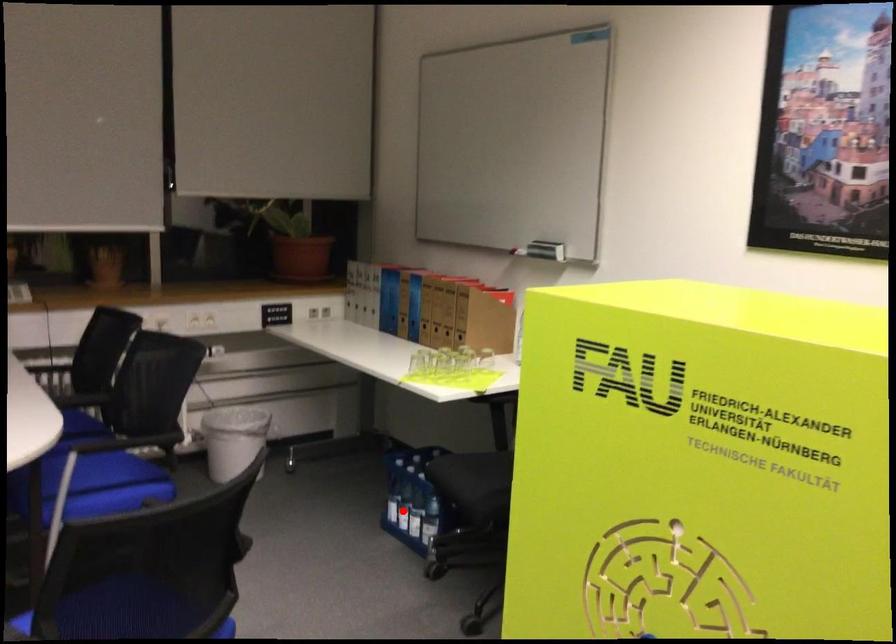
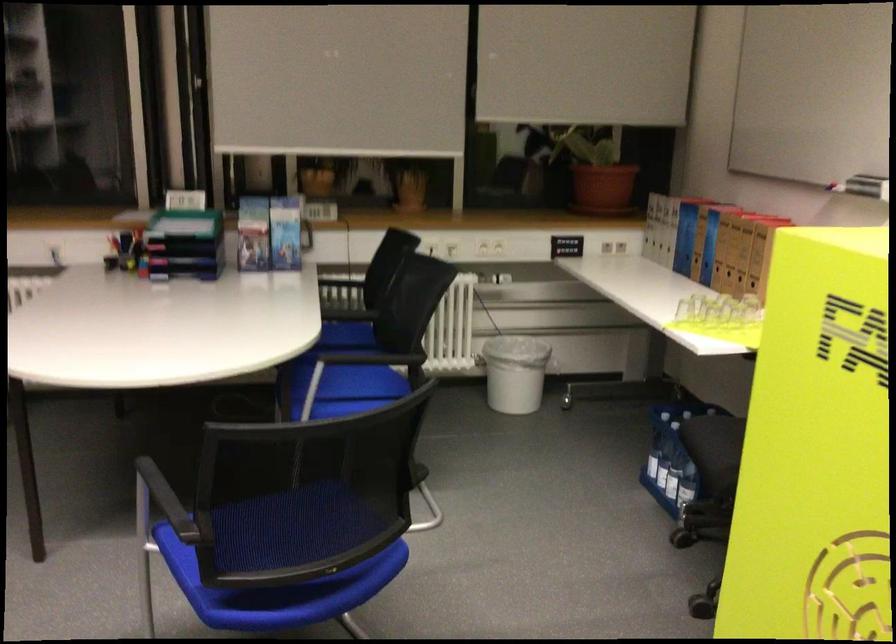
Locate, in the second image, the point that corresponds to the highlighted location in the first image.

(661, 465)